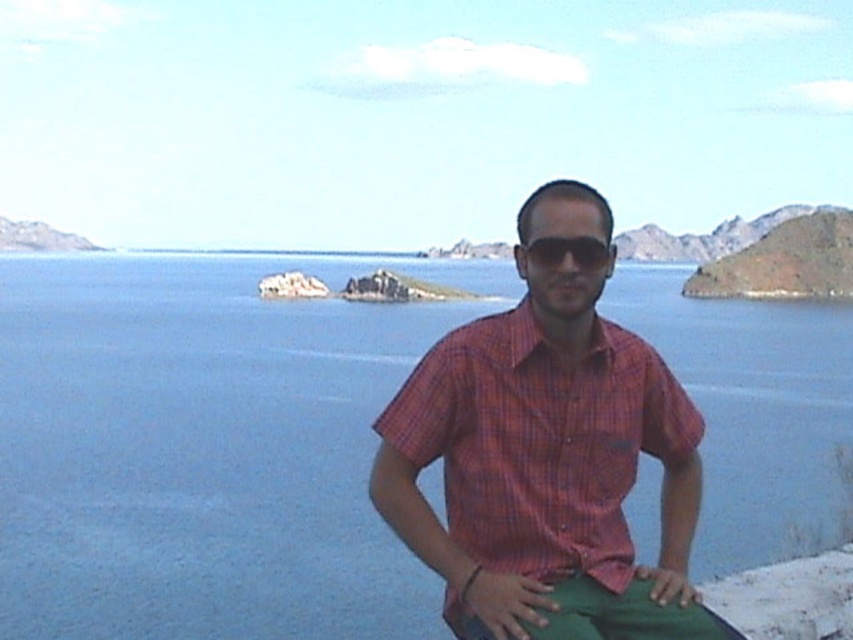
Question: Which object is positioned closest to the black matte sunglasses at center?

Choices:
 (A) blue water at center
 (B) plaid cotton shirt at center

Answer: (B)

Question: Is blue water at center to the left of plaid cotton shirt at center from the viewer's perspective?

Choices:
 (A) yes
 (B) no

Answer: (B)

Question: Can you confirm if plaid cotton shirt at center is positioned below black matte sunglasses at center?

Choices:
 (A) yes
 (B) no

Answer: (A)

Question: Does blue water at center have a smaller size compared to plaid cotton shirt at center?

Choices:
 (A) no
 (B) yes

Answer: (A)

Question: Estimate the real-world distances between objects in this image. Which object is closer to the plaid cotton shirt at center?

Choices:
 (A) blue water at center
 (B) black matte sunglasses at center

Answer: (B)

Question: Which object is positioned farthest from the black matte sunglasses at center?

Choices:
 (A) blue water at center
 (B) plaid cotton shirt at center

Answer: (A)